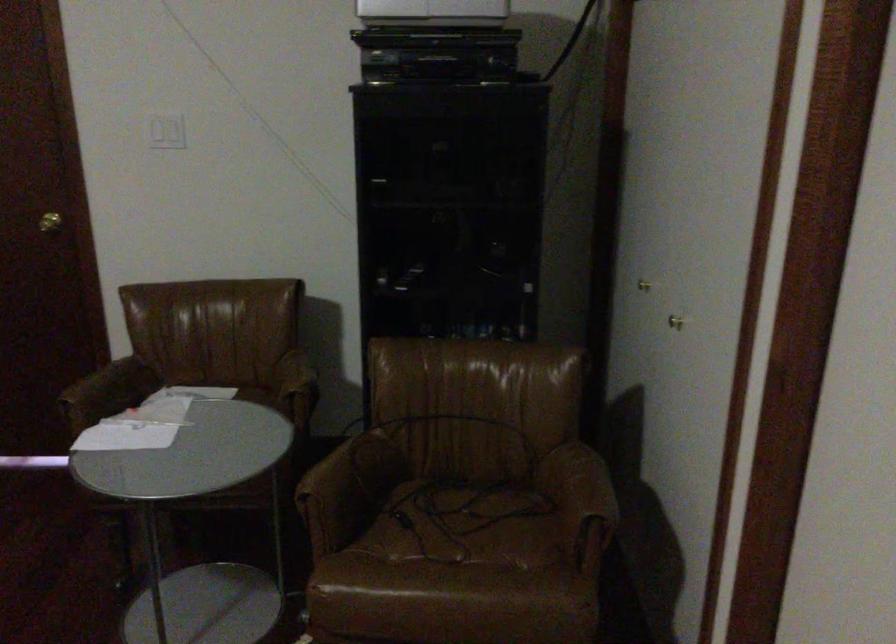
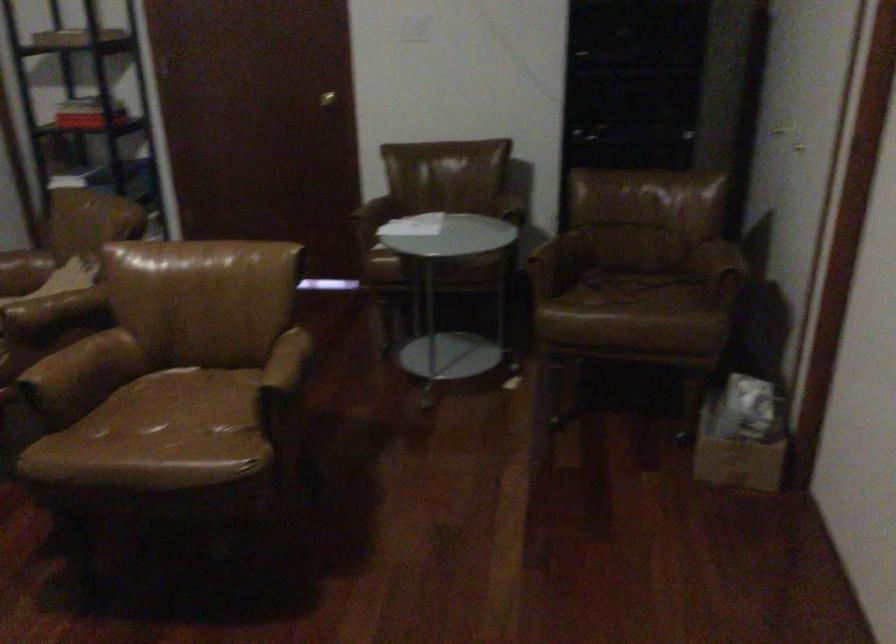
Question: The camera is either moving clockwise (left) or counter-clockwise (right) around the object. The first image is from the beginning of the video and the second image is from the end. Is the camera moving left or right when shooting the video?

Choices:
 (A) Left
 (B) Right

Answer: (B)